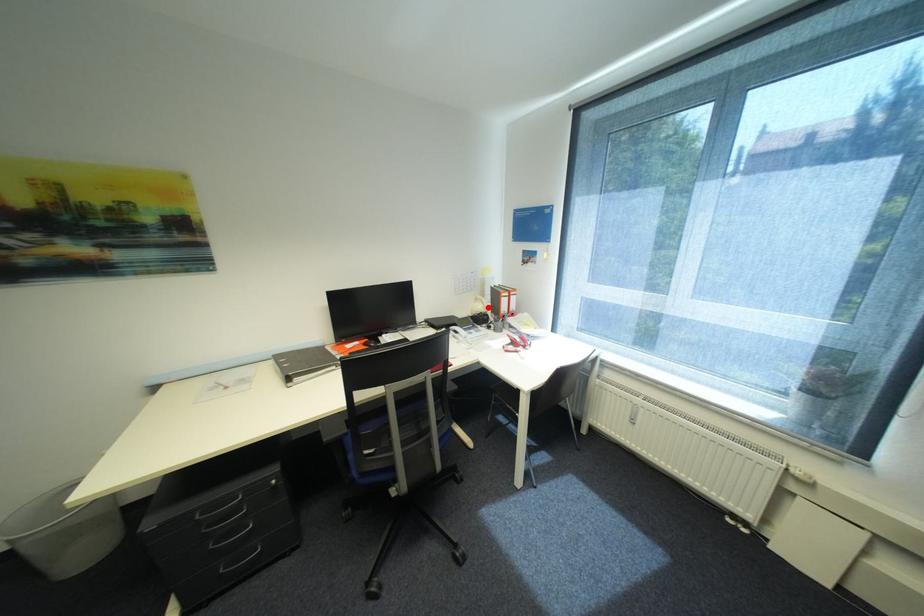
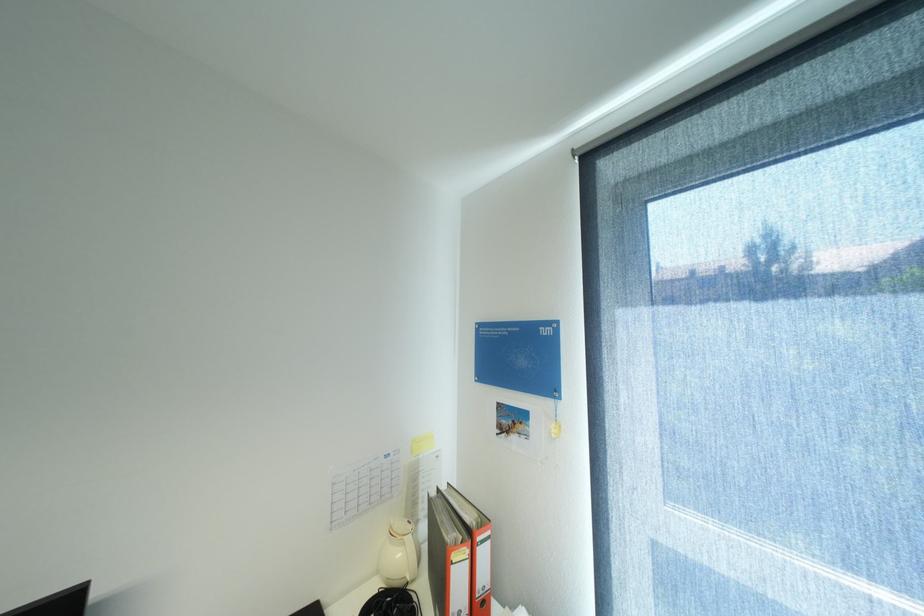
Find the pixel in the second image that matches the highlighted location in the first image.

(407, 554)